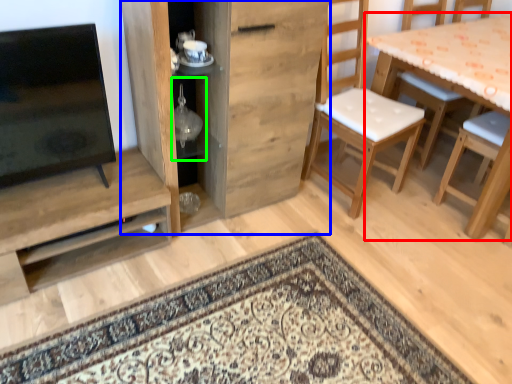
Question: Which object is positioned closest to table (highlighted by a red box)? Select from cabinetry (highlighted by a blue box) and shelf (highlighted by a green box).

Choices:
 (A) cabinetry
 (B) shelf

Answer: (A)